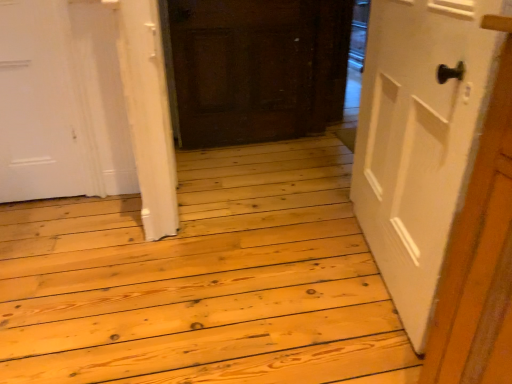
Question: From the image's perspective, is white matte door at right, which is counted as the second door, starting from the left, above or below dark brown wood door at center, placed as the second door when sorted from right to left?

Choices:
 (A) below
 (B) above

Answer: (A)

Question: Based on their sizes in the image, would you say white matte door at right, the second door from the back, is bigger or smaller than dark brown wood door at center, the 1th door viewed from the left?

Choices:
 (A) big
 (B) small

Answer: (A)

Question: From a real-world perspective, is white matte door at right, which is counted as the second door, starting from the left, positioned above or below dark brown wood door at center, placed as the second door when sorted from right to left?

Choices:
 (A) above
 (B) below

Answer: (A)

Question: From a real-world perspective, relative to white matte door at right, which is counted as the second door, starting from the left, is dark brown wood door at center, the 1th door viewed from the left, vertically above or below?

Choices:
 (A) above
 (B) below

Answer: (B)

Question: From the image's perspective, is dark brown wood door at center, which is counted as the 1th door, starting from the back, located above or below white matte door at right, which is the 1th door in right-to-left order?

Choices:
 (A) below
 (B) above

Answer: (B)

Question: In terms of height, does dark brown wood door at center, the 1th door viewed from the left, look taller or shorter compared to white matte door at right, which is counted as the second door, starting from the left?

Choices:
 (A) tall
 (B) short

Answer: (B)

Question: Do you think dark brown wood door at center, placed as the second door when sorted from right to left, is within white matte door at right, acting as the 1th door starting from the front, or outside of it?

Choices:
 (A) outside
 (B) inside

Answer: (A)